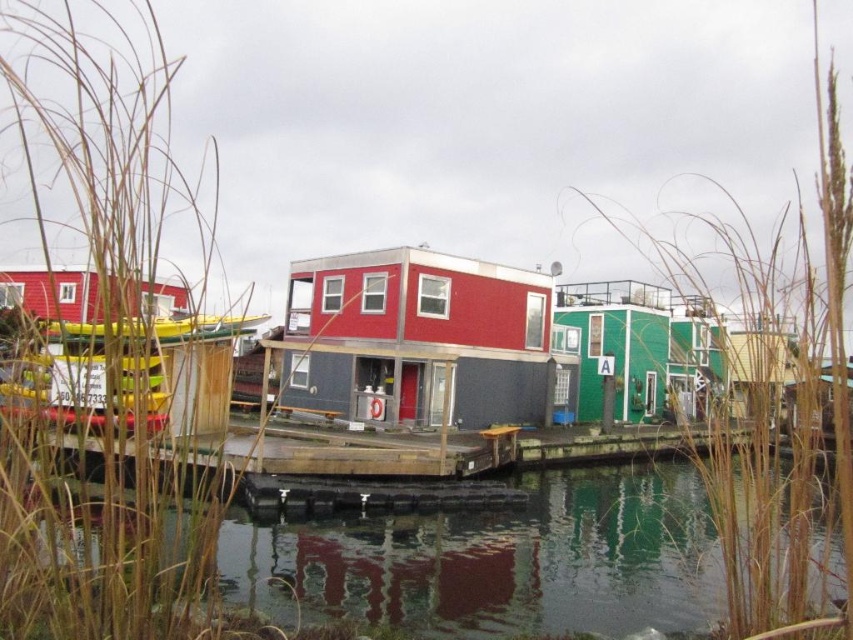
You are a photographer standing at the edge of the pier. You want to capture a photo that includes both the brown grass at upper right and the matte red houseboat at center. Given that your camera has a maximum zoom range of 10 meters, will you be able to fit both subjects into the frame without moving closer?

The brown grass at upper right and the matte red houseboat at center are 13.12 meters apart. Since the camera can only zoom up to 10 meters, it won cannot capture both subjects within the frame without moving closer.

You are standing on the wooden pier and want to reach the point marked at coordinates point (257,595). Considering the pier is 30 feet long, can you safely walk to that point without exceeding the pier length?

The point (257,595) is 28.53 feet from the viewer, which is within the 30 feet length of the pier. Therefore, you can safely walk to that point without exceeding the pier length.